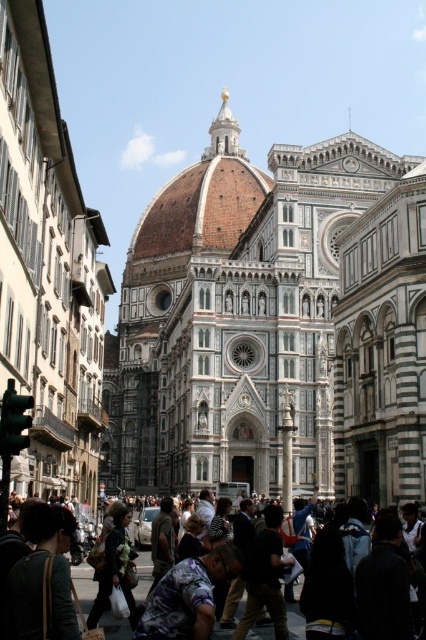
Question: Is white marble church at center to the right of dark clothing crowd at center from the viewer's perspective?

Choices:
 (A) no
 (B) yes

Answer: (A)

Question: From the image, what is the correct spatial relationship of white marble church at center in relation to dark clothing crowd at center?

Choices:
 (A) above
 (B) below

Answer: (A)

Question: Among these points, which one is farthest from the camera?

Choices:
 (A) coord(374,310)
 (B) coord(60,627)

Answer: (A)

Question: Which point is farther to the camera?

Choices:
 (A) (180, 580)
 (B) (256, 196)

Answer: (B)

Question: Is white marble church at center below dark clothing crowd at center?

Choices:
 (A) no
 (B) yes

Answer: (A)